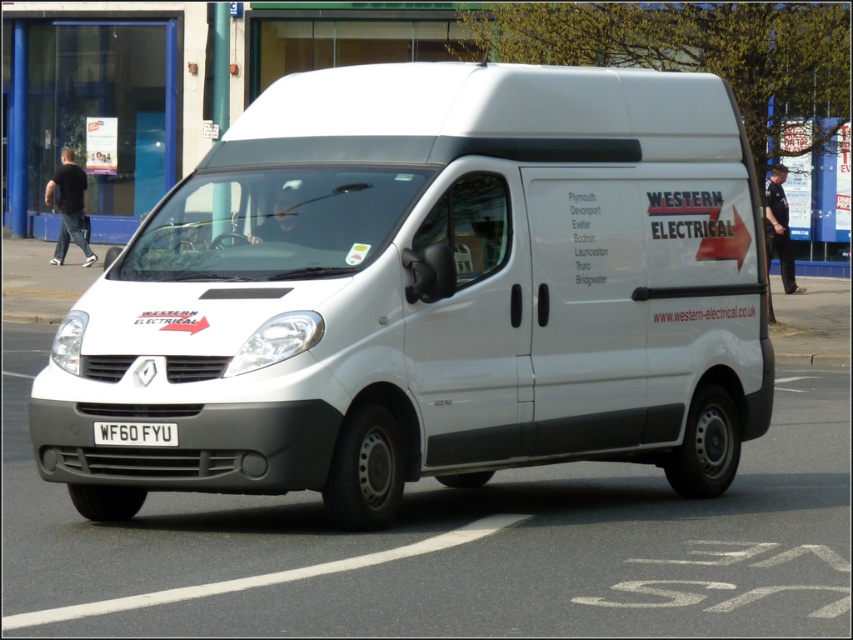
You are a delivery driver who needs to check the license plate of the white matte van at center. Can you see the white metallic license plate at center clearly from your current position?

The white matte van at center is in front of the white metallic license plate at center, so the van is blocking the view of the license plate, making it difficult to see clearly.